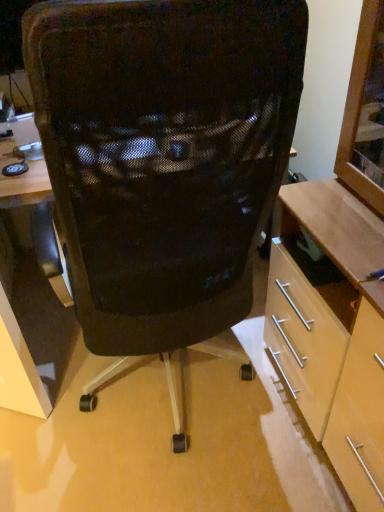
Question: Does black mesh chair at center have a lesser height compared to light wood cabinet at right?

Choices:
 (A) yes
 (B) no

Answer: (B)

Question: Is black mesh chair at center further to the viewer compared to light wood cabinet at right?

Choices:
 (A) yes
 (B) no

Answer: (A)

Question: From the image's perspective, is black mesh chair at center located beneath light wood cabinet at right?

Choices:
 (A) no
 (B) yes

Answer: (A)

Question: Does black mesh chair at center have a greater width compared to light wood cabinet at right?

Choices:
 (A) no
 (B) yes

Answer: (B)

Question: Could you tell me if black mesh chair at center is turned towards light wood cabinet at right?

Choices:
 (A) yes
 (B) no

Answer: (B)

Question: Is black mesh chair at center in front of light wood cabinet at right?

Choices:
 (A) yes
 (B) no

Answer: (B)

Question: Considering the relative positions of light wood cabinet at right and black mesh chair at center in the image provided, is light wood cabinet at right to the right of black mesh chair at center from the viewer's perspective?

Choices:
 (A) yes
 (B) no

Answer: (A)

Question: Considering the relative positions of light wood cabinet at right and black mesh chair at center in the image provided, is light wood cabinet at right behind black mesh chair at center?

Choices:
 (A) no
 (B) yes

Answer: (A)

Question: Are light wood cabinet at right and black mesh chair at center beside each other?

Choices:
 (A) yes
 (B) no

Answer: (B)

Question: Would you say black mesh chair at center is part of light wood cabinet at right's contents?

Choices:
 (A) no
 (B) yes

Answer: (A)

Question: Does light wood cabinet at right come in front of black mesh chair at center?

Choices:
 (A) yes
 (B) no

Answer: (A)

Question: Is light wood cabinet at right outside of black mesh chair at center?

Choices:
 (A) yes
 (B) no

Answer: (A)

Question: From the image's perspective, is light wood cabinet at right above or below black mesh chair at center?

Choices:
 (A) above
 (B) below

Answer: (B)